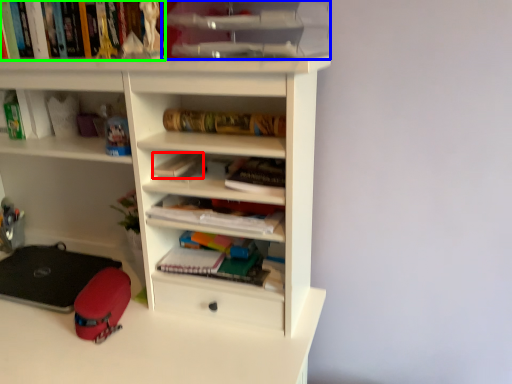
Question: Which object is the closest to the paperback book (highlighted by a red box)? Choose among these: cabinet (highlighted by a blue box) or book (highlighted by a green box).

Choices:
 (A) cabinet
 (B) book

Answer: (A)